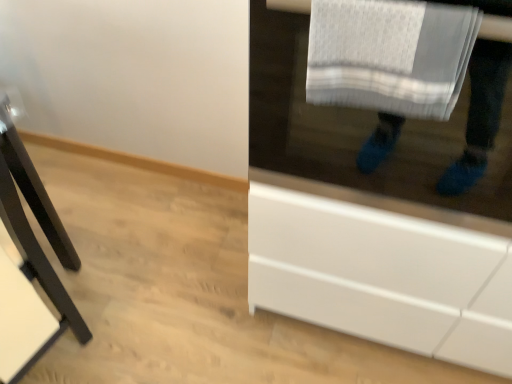
Question: Can we say black matte table at left lies outside white glossy cabinet at lower right?

Choices:
 (A) yes
 (B) no

Answer: (A)

Question: Could you tell me if black matte table at left is turned towards white glossy cabinet at lower right?

Choices:
 (A) yes
 (B) no

Answer: (B)

Question: From a real-world perspective, is black matte table at left under white glossy cabinet at lower right?

Choices:
 (A) yes
 (B) no

Answer: (A)

Question: From the image's perspective, is black matte table at left below white glossy cabinet at lower right?

Choices:
 (A) yes
 (B) no

Answer: (A)

Question: Can you confirm if black matte table at left is taller than white glossy cabinet at lower right?

Choices:
 (A) no
 (B) yes

Answer: (B)

Question: Is black matte table at left next to white glossy cabinet at lower right?

Choices:
 (A) yes
 (B) no

Answer: (B)

Question: Can you confirm if white glossy cabinet at lower right is wider than black matte table at left?

Choices:
 (A) no
 (B) yes

Answer: (B)

Question: From a real-world perspective, is white glossy cabinet at lower right located beneath black matte table at left?

Choices:
 (A) no
 (B) yes

Answer: (A)

Question: Is white glossy cabinet at lower right to the right of black matte table at left from the viewer's perspective?

Choices:
 (A) yes
 (B) no

Answer: (A)

Question: Does white glossy cabinet at lower right have a greater height compared to black matte table at left?

Choices:
 (A) no
 (B) yes

Answer: (A)

Question: Is white glossy cabinet at lower right further to camera compared to black matte table at left?

Choices:
 (A) yes
 (B) no

Answer: (B)

Question: Does white glossy cabinet at lower right have a lesser height compared to black matte table at left?

Choices:
 (A) no
 (B) yes

Answer: (B)

Question: From the image's perspective, is white glossy cabinet at lower right beneath white textured towel at upper right?

Choices:
 (A) yes
 (B) no

Answer: (B)